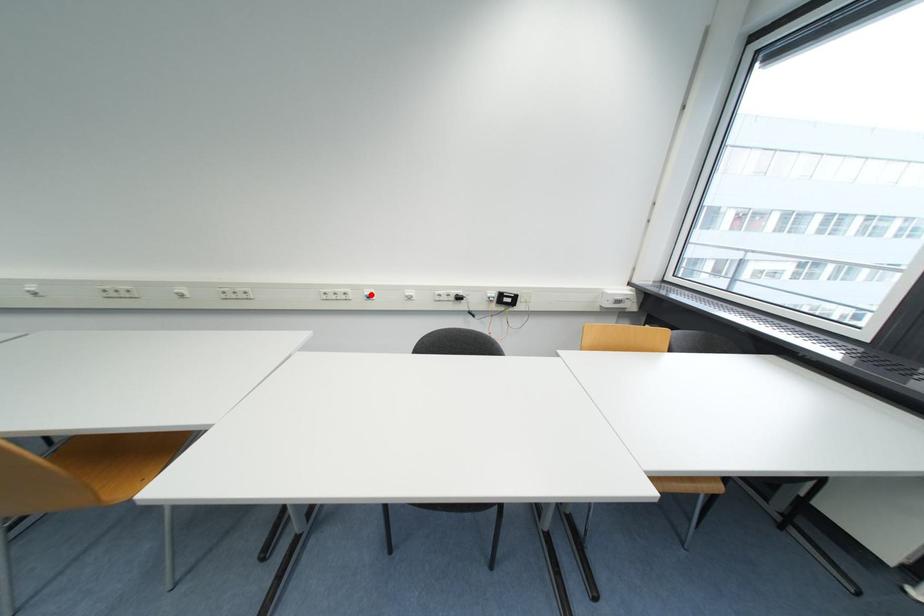
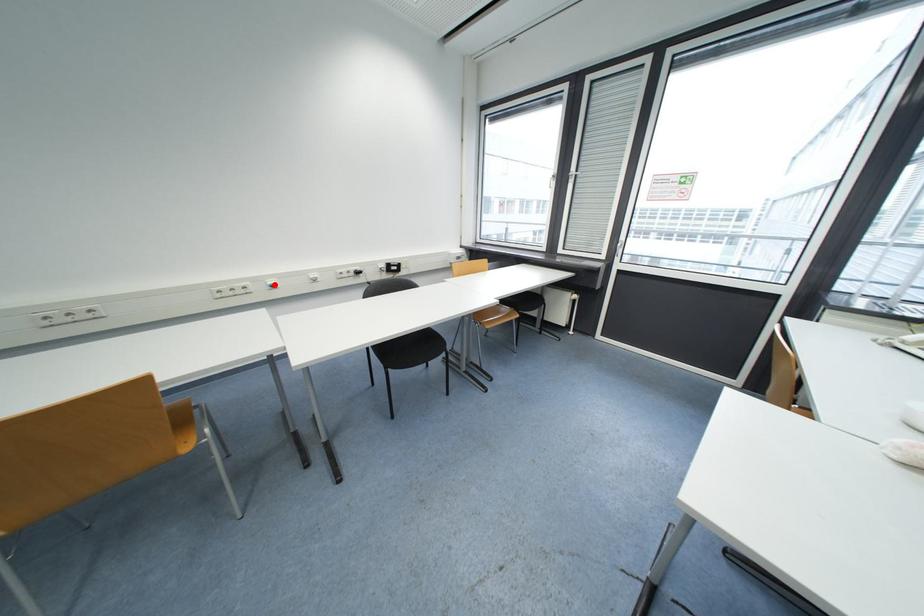
I am providing you with two images of the same scene from different viewpoints. A red point is marked on the first image and another point is marked on the second image. Is the red point in image1 aligned with the point shown in image2?

Yes